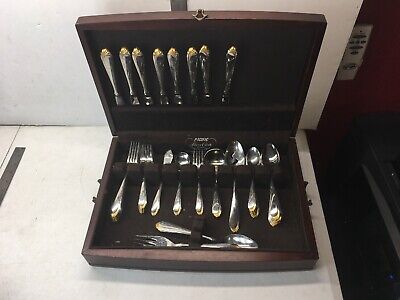
The image size is (400, 300). What are the coordinates of `spoon` in the screenshot? It's located at (273, 152), (256, 155), (234, 155), (212, 155), (179, 160), (241, 240).